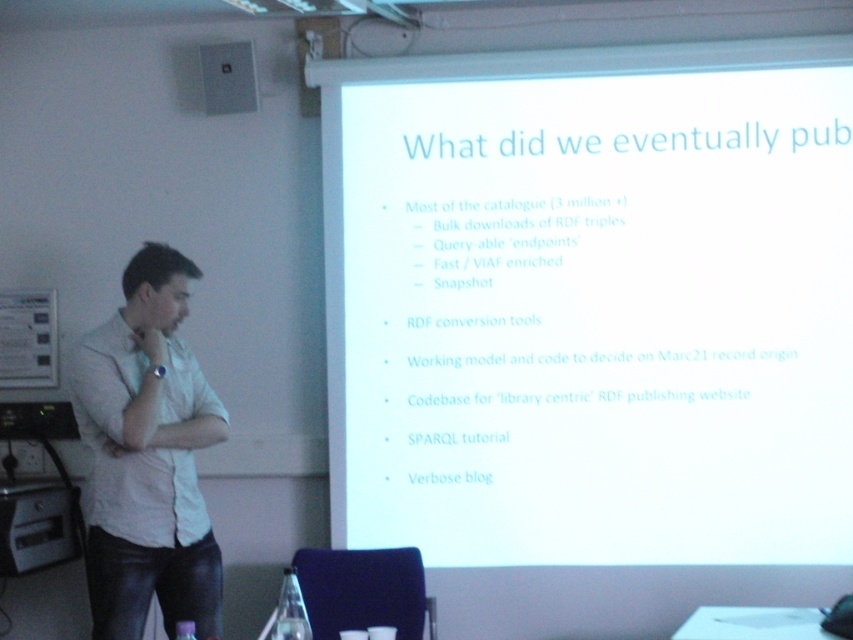
You are an attendee at a presentation and want to take a photo of the presenter and the slide. The camera you have can focus on objects within 1.2 meters. Can you capture both the white shirt at left and the white matte projection screen at upper center in one shot without moving the camera?

The white matte projection screen at upper center is 1.13 meters from the white shirt at left. Since the camera can focus within 1.2 meters, the distance between them is within the camera range. Therefore, you can capture both the white shirt at left and the white matte projection screen at upper center in one shot without moving the camera.

You are an attendee at the presentation. You need to take a photo of the slide on the white matte projection screen at upper center without blocking the presenter in the white shirt at left. Since the screen is larger, where should you position yourself to ensure the entire screen is in frame while avoiding the presenter?

Position yourself to the right side of the presenter in the white shirt at left. Since the white matte projection screen at upper center is larger, capturing it fully would require angling the camera towards the screen while staying out of the presenter and audience view.

You are an attendee at a presentation. You notice the white matte projection screen at upper center and the white shirt at left. Which object is taller?

The white matte projection screen at upper center is taller than the white shirt at left.